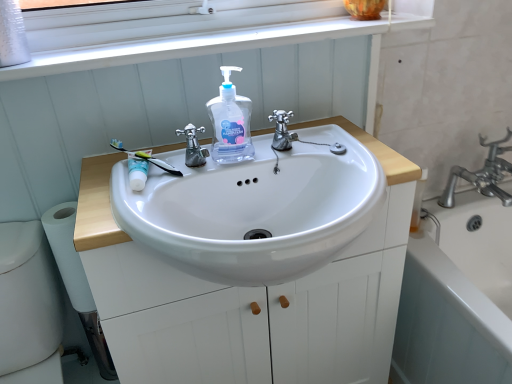
What do you see at coordinates (146, 158) in the screenshot? This screenshot has height=384, width=512. I see `green rubber toothbrush at upper left` at bounding box center [146, 158].

The width and height of the screenshot is (512, 384). What do you see at coordinates (139, 289) in the screenshot? I see `white matte cabinet at center` at bounding box center [139, 289].

In order to face white ceramic bathtub at lower right, should I rotate leftwards or rightwards?

Rotate right and turn 30.291 degrees.

Locate an element on the screen. translucent plastic hand soap at center is located at coordinates (230, 122).

At what (x,y) coordinates should I click in order to perform the action: click on white glossy toilet bowl at lower left. Please return your answer as a coordinate pair (x, y). Looking at the image, I should click on 28,307.

Identify the location of white glossy mouthwash at upper left. The height and width of the screenshot is (384, 512). tap(137, 171).

In order to face white matte toilet paper at lower left, should I rotate leftwards or rightwards?

To align with it, rotate left about 22.634°.

What do you see at coordinates (213, 45) in the screenshot? I see `white plastic window frame at upper center` at bounding box center [213, 45].

The height and width of the screenshot is (384, 512). Identify the location of green rubber toothbrush at upper left. (146, 158).

Is the position of white plastic window frame at upper center less distant than that of translucent plastic hand soap at center?

No, it is not.

Is translucent plastic hand soap at center at the back of white plastic window frame at upper center?

No.

Are white plastic window frame at upper center and translucent plastic hand soap at center beside each other?

white plastic window frame at upper center and translucent plastic hand soap at center are not in contact.

From a real-world perspective, is white plastic window frame at upper center under translucent plastic hand soap at center?

No.

Looking at this image, considering the sizes of white plastic window frame at upper center and white glossy toilet bowl at lower left in the image, is white plastic window frame at upper center bigger or smaller than white glossy toilet bowl at lower left?

Clearly, white plastic window frame at upper center is smaller in size than white glossy toilet bowl at lower left.

In the image, there is a white glossy toilet bowl at lower left. At what (x,y) coordinates should I click in order to perform the action: click on window frame above it (from the image's perspective). Please return your answer as a coordinate pair (x, y). Looking at the image, I should click on (213, 45).

Which is less distant, (51, 61) or (0, 257)?

Point (51, 61) appears to be closer to the viewer than point (0, 257).

Is white plastic window frame at upper center at the right side of white glossy toilet bowl at lower left?

Yes.

From the image's perspective, which object appears higher, polished chrome faucet at center, which is counted as the 1th tap, starting from the left, or white matte cabinet at center?

polished chrome faucet at center, which is counted as the 1th tap, starting from the left, appears higher in the image.

Would you say white matte cabinet at center is part of polished chrome faucet at center, which is counted as the 1th tap, starting from the left,'s contents?

No, white matte cabinet at center is not surrounded by polished chrome faucet at center, which is counted as the 1th tap, starting from the left.

Considering the positions of objects polished chrome faucet at center, which is counted as the 1th tap, starting from the left, and white matte cabinet at center in the image provided, who is in front, polished chrome faucet at center, which is counted as the 1th tap, starting from the left, or white matte cabinet at center?

white matte cabinet at center is closer to the camera.

Is white ceramic bathtub at lower right outside of green rubber toothbrush at upper left?

white ceramic bathtub at lower right lies outside green rubber toothbrush at upper left's area.

Image resolution: width=512 pixels, height=384 pixels. What are the coordinates of `bath located underneath the green rubber toothbrush at upper left (from a real-world perspective)` in the screenshot? It's located at (456, 297).

Looking at this image, from the image's perspective, would you say white ceramic bathtub at lower right is positioned over green rubber toothbrush at upper left?

Actually, white ceramic bathtub at lower right appears below green rubber toothbrush at upper left in the image.

Is polished chrome faucet at center, which is the 1th tap in right-to-left order, thinner than white matte toilet paper at lower left?

Indeed, polished chrome faucet at center, which is the 1th tap in right-to-left order, has a lesser width compared to white matte toilet paper at lower left.

Is the surface of polished chrome faucet at center, which is the 1th tap in right-to-left order, in direct contact with white matte toilet paper at lower left?

No, polished chrome faucet at center, which is the 1th tap in right-to-left order, is not making contact with white matte toilet paper at lower left.

Choose the correct answer: Is polished chrome faucet at center, which is the 2th tap in left-to-right order, inside white matte toilet paper at lower left or outside it?

polished chrome faucet at center, which is the 2th tap in left-to-right order, exists outside the volume of white matte toilet paper at lower left.

Could you measure the distance between white plastic window frame at upper center and white glossy mouthwash at upper left?

The distance of white plastic window frame at upper center from white glossy mouthwash at upper left is 15.76 inches.

Who is more distant, white plastic window frame at upper center or white glossy mouthwash at upper left?

white plastic window frame at upper center is more distant.

Is white plastic window frame at upper center positioned beyond the bounds of white glossy mouthwash at upper left?

Indeed, white plastic window frame at upper center is completely outside white glossy mouthwash at upper left.

Does white plastic window frame at upper center have a lesser height compared to white glossy mouthwash at upper left?

Correct, white plastic window frame at upper center is not as tall as white glossy mouthwash at upper left.

Which object is closer to the camera taking this photo, translucent plastic hand soap at center or white matte cabinet at center?

white matte cabinet at center is more forward.

Between point (238, 115) and point (103, 175), which one is positioned behind?

The point (103, 175) is farther from the camera.

Considering the sizes of translucent plastic hand soap at center and white matte cabinet at center in the image, is translucent plastic hand soap at center wider or thinner than white matte cabinet at center?

In the image, translucent plastic hand soap at center appears to be more narrow than white matte cabinet at center.

The height and width of the screenshot is (384, 512). In order to click on bathroom cabinet on the right side of translucent plastic hand soap at center in this screenshot , I will do `click(139, 289)`.

This screenshot has height=384, width=512. Identify the location of window frame on the left of translucent plastic hand soap at center. (213, 45).

I want to click on toilet bowl lying below the white plastic window frame at upper center (from the image's perspective), so click(28, 307).

From the image, which object appears to be farther from white glossy mouthwash at upper left, polished chrome faucet at center, which is the 1th tap in right-to-left order, or white matte cabinet at center?

white matte cabinet at center.

Looking at the image, which one is located further to white plastic window frame at upper center, white matte cabinet at center or white ceramic bathtub at lower right?

The object further to white plastic window frame at upper center is white ceramic bathtub at lower right.

From the image, which object appears to be nearer to polished chrome faucet at center, which is the 1th tap in right-to-left order, green rubber toothbrush at upper left or white plastic window frame at upper center?

The object closer to polished chrome faucet at center, which is the 1th tap in right-to-left order, is green rubber toothbrush at upper left.

When comparing their distances from white ceramic bathtub at lower right, does green rubber toothbrush at upper left or white glossy toilet bowl at lower left seem closer?

green rubber toothbrush at upper left.

Estimate the real-world distances between objects in this image. Which object is closer to white matte toilet paper at lower left, polished chrome faucet at center, which is the 1th tap in right-to-left order, or green rubber toothbrush at upper left?

The object closer to white matte toilet paper at lower left is green rubber toothbrush at upper left.

Estimate the real-world distances between objects in this image. Which object is closer to white glossy mouthwash at upper left, white plastic window frame at upper center or polished chrome faucet at center, which is the 1th tap in right-to-left order?

polished chrome faucet at center, which is the 1th tap in right-to-left order.

Estimate the real-world distances between objects in this image. Which object is closer to white glossy mouthwash at upper left, white glossy toilet bowl at lower left or white ceramic bathtub at lower right?

white glossy toilet bowl at lower left.

Based on their spatial positions, is polished chrome faucet at center, which is counted as the 1th tap, starting from the left, or green rubber toothbrush at upper left further from polished chrome faucet at center, which is the 1th tap in right-to-left order?

The object further to polished chrome faucet at center, which is the 1th tap in right-to-left order, is green rubber toothbrush at upper left.

Image resolution: width=512 pixels, height=384 pixels. I want to click on tap between polished chrome faucet at center, which is the 1th tap in right-to-left order, and white glossy toilet bowl at lower left, in the vertical direction, so click(193, 146).

The width and height of the screenshot is (512, 384). Find the location of `bathroom cabinet located between polished chrome faucet at center, which is counted as the 1th tap, starting from the left, and white ceramic bathtub at lower right in the left-right direction`. bathroom cabinet located between polished chrome faucet at center, which is counted as the 1th tap, starting from the left, and white ceramic bathtub at lower right in the left-right direction is located at coordinates (139, 289).

You are a GUI agent. You are given a task and a screenshot of the screen. Output one action in this format:
    pyautogui.click(x=<x>, y=<y>)
    Task: Click on the toothbrush between white matte toilet paper at lower left and polished chrome faucet at center, which is the 1th tap in right-to-left order, in the horizontal direction
    The image size is (512, 384).
    Given the screenshot: What is the action you would take?
    pyautogui.click(x=146, y=158)

Find the location of a particular element. The height and width of the screenshot is (384, 512). toothbrush that lies between white plastic window frame at upper center and white matte cabinet at center from top to bottom is located at coordinates (146, 158).